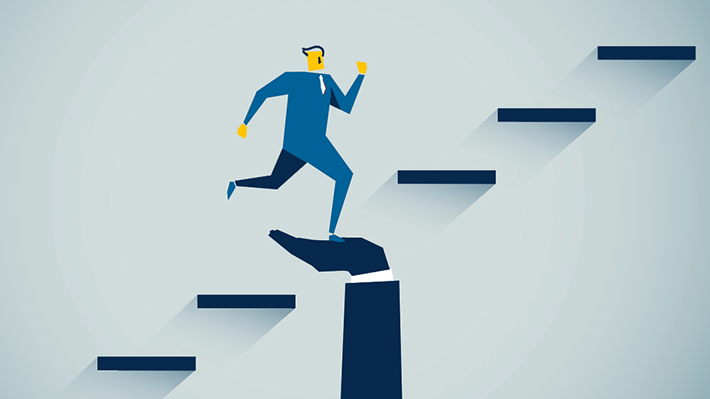
Find the location of a particular element. The width and height of the screenshot is (710, 399). steps is located at coordinates (155, 364), (251, 295), (461, 165), (572, 108), (644, 44).